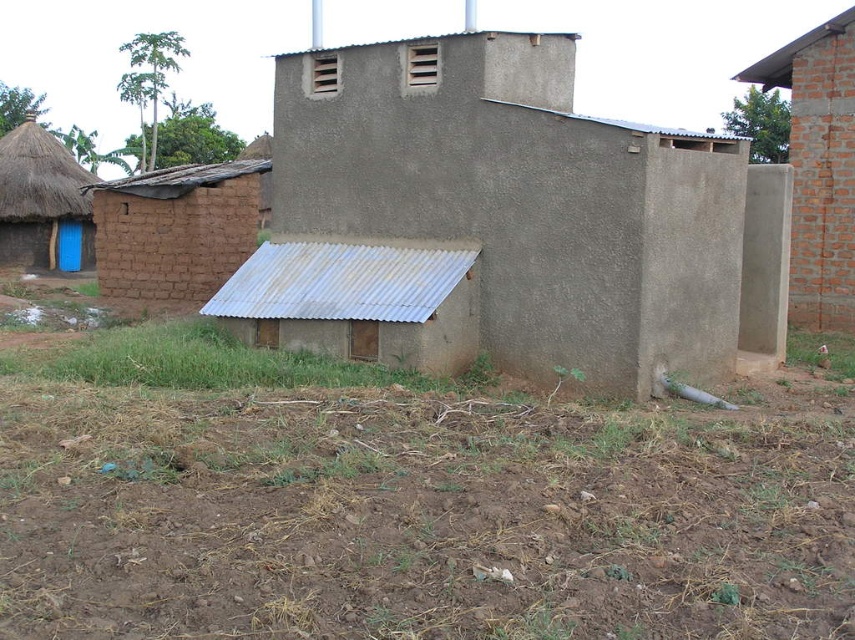
Question: Which point is farther from the camera taking this photo?

Choices:
 (A) (422, 81)
 (B) (301, 253)
 (C) (81, 209)
 (D) (470, 476)

Answer: (C)

Question: Based on their relative distances, which object is nearer to the blue wooden door at left?

Choices:
 (A) brown soil at lower center
 (B) rusty metal shed at lower center
 (C) brick wall at right
 (D) brown mud hut at left

Answer: (D)

Question: Among these objects, which one is nearest to the camera?

Choices:
 (A) blue wooden door at left
 (B) brick wall at right
 (C) matte concrete hut at center
 (D) brown soil at lower center

Answer: (D)

Question: Is matte concrete hut at center closer to the viewer compared to brown mud hut at left?

Choices:
 (A) no
 (B) yes

Answer: (B)

Question: Considering the relative positions of brick wall at right and blue wooden door at left in the image provided, where is brick wall at right located with respect to blue wooden door at left?

Choices:
 (A) below
 (B) above

Answer: (B)

Question: Considering the relative positions of brown mud hut at left and blue wooden door at left in the image provided, where is brown mud hut at left located with respect to blue wooden door at left?

Choices:
 (A) left
 (B) right

Answer: (B)